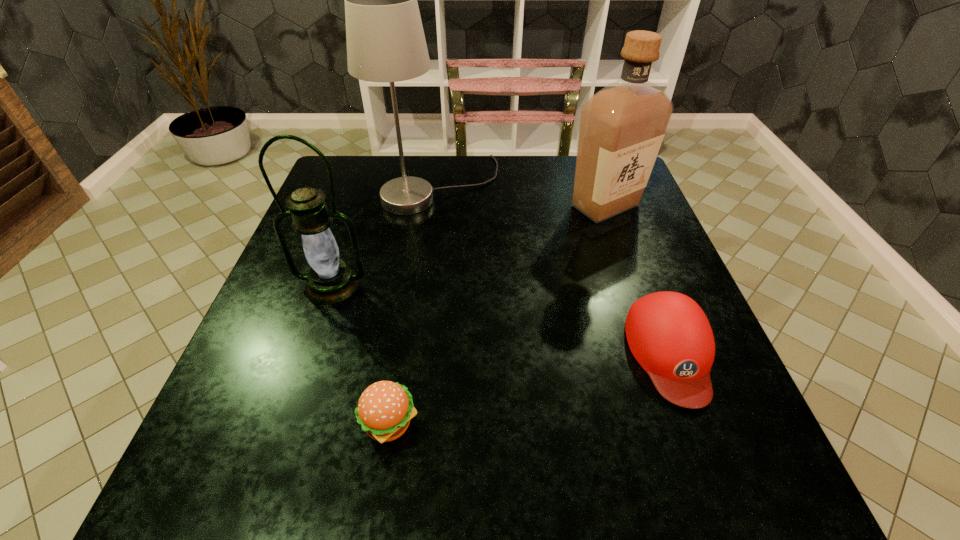
Find the location of `vacant point located on the back of the hamburger`. vacant point located on the back of the hamburger is located at coordinates (407, 308).

Locate an element on the screen. table lamp that is at the far edge is located at coordinates (385, 39).

The width and height of the screenshot is (960, 540). I want to click on liquor that is positioned at the far edge, so click(622, 126).

Locate an element on the screen. The image size is (960, 540). object that is at the near edge is located at coordinates (385, 408).

Where is `table lamp located at the left edge`? table lamp located at the left edge is located at coordinates (385, 39).

You are a GUI agent. You are given a task and a screenshot of the screen. Output one action in this format:
    pyautogui.click(x=<x>, y=<y>)
    Task: Click on the lantern positioned at the left edge
    The height and width of the screenshot is (540, 960).
    Given the screenshot: What is the action you would take?
    pyautogui.click(x=329, y=281)

I want to click on liquor that is positioned at the right edge, so click(x=622, y=126).

Find the location of `baseball cap that is at the right edge`. baseball cap that is at the right edge is located at coordinates (669, 335).

This screenshot has width=960, height=540. Find the location of `object at the far left corner`. object at the far left corner is located at coordinates (385, 39).

The height and width of the screenshot is (540, 960). Identify the location of object at the far right corner. (622, 126).